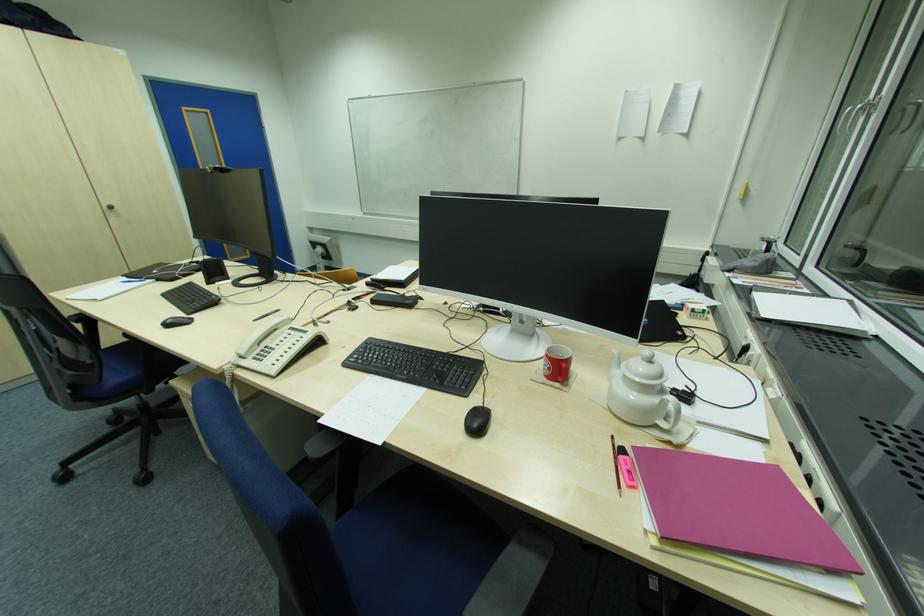
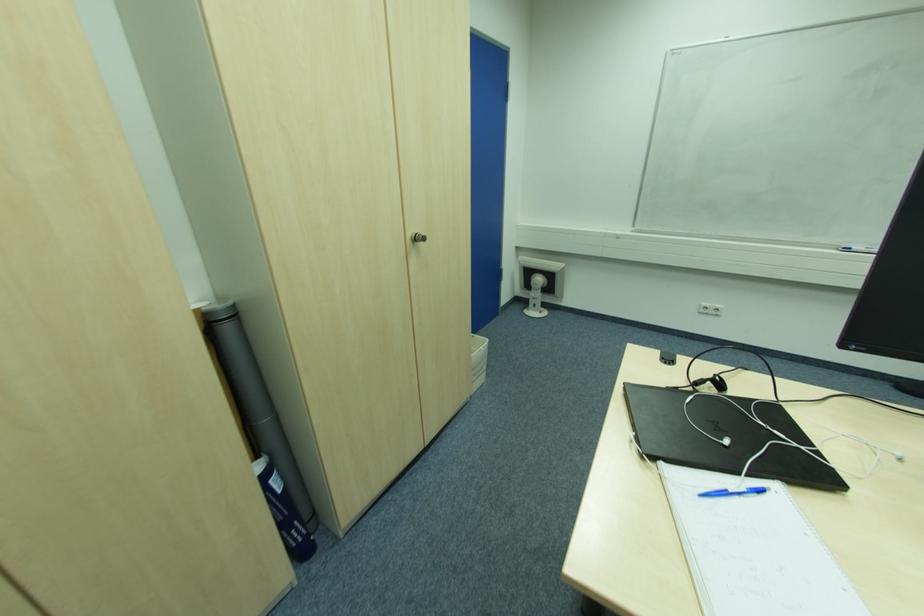
The images are taken continuously from a first-person perspective. In which direction are you moving?

The cameraman walked toward left, forward.